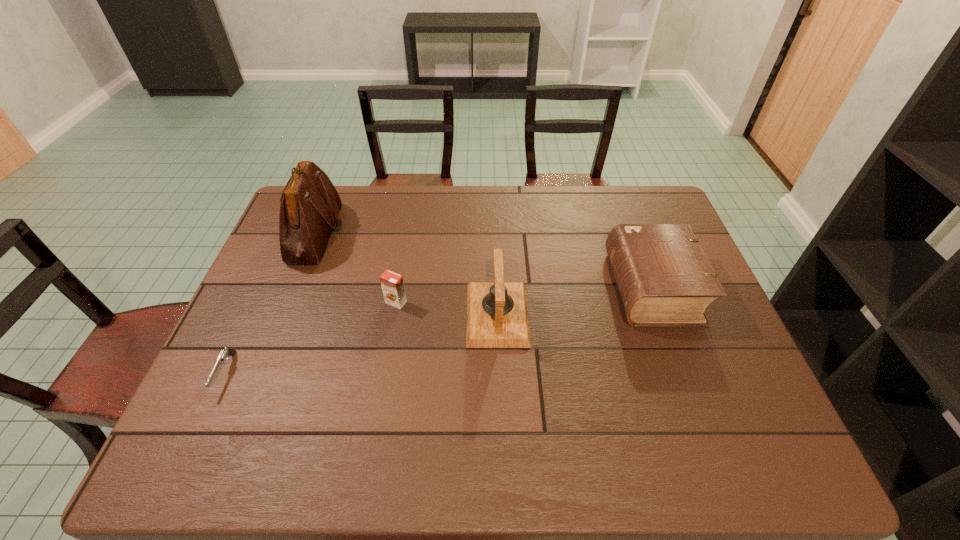
In the image, there is a desktop. At what (x,y) coordinates should I click in order to perform the action: click on free region at the far edge. Please return your answer as a coordinate pair (x, y). This screenshot has width=960, height=540. Looking at the image, I should click on (616, 215).

Where is `free space at the near edge of the desktop`? Image resolution: width=960 pixels, height=540 pixels. free space at the near edge of the desktop is located at coordinates (409, 447).

Locate an element on the screen. This screenshot has height=540, width=960. vacant space at the left edge is located at coordinates (294, 280).

Identify the location of vacant position at the far right corner of the desktop. Image resolution: width=960 pixels, height=540 pixels. (644, 194).

At what (x,y) coordinates should I click in order to perform the action: click on free spot between the Bible and the fourth shortest object. Please return your answer as a coordinate pair (x, y). This screenshot has width=960, height=540. Looking at the image, I should click on (575, 301).

Where is `free space that is in between the tallest object and the second object from right to left`? The image size is (960, 540). free space that is in between the tallest object and the second object from right to left is located at coordinates (407, 273).

The image size is (960, 540). Identify the location of empty space that is in between the fourth shortest object and the tallest object. (407, 273).

Identify the location of unoccupied position between the shoulder bag and the third object from right to left. (356, 268).

At what (x,y) coordinates should I click in order to perform the action: click on empty space that is in between the rightmost object and the shortest object. Please return your answer as a coordinate pair (x, y). This screenshot has width=960, height=540. Looking at the image, I should click on (439, 330).

Where is `free space between the tallest object and the orange juice`? The width and height of the screenshot is (960, 540). free space between the tallest object and the orange juice is located at coordinates (356, 268).